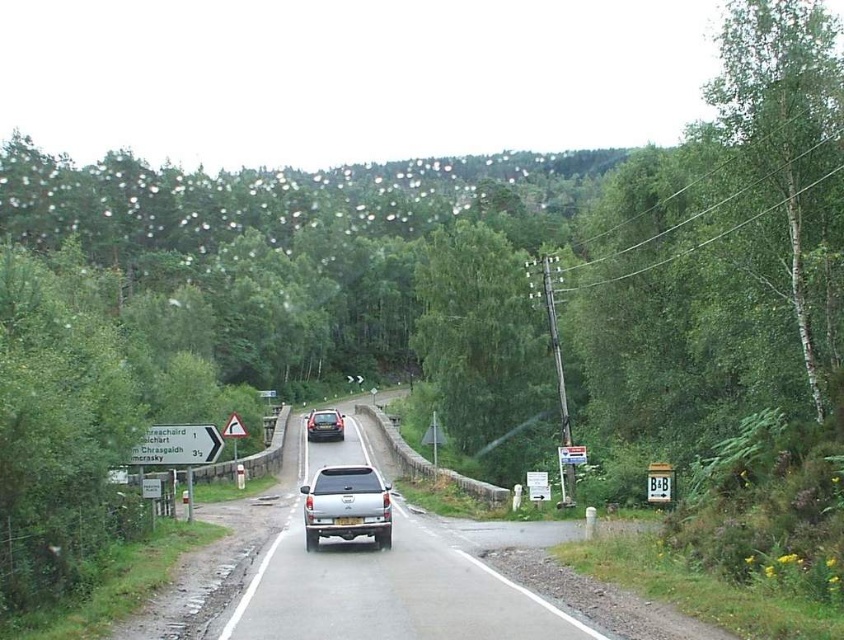
In the scene shown: You are a hiker trying to determine which object is taller between the white bark tree at right and the white plastic sign at left. Based on the scene, which one is taller?

Answer: The white bark tree at right is taller than the white plastic sign at left.

You are driving a car with a length of 5 meters. You need to pass between the white plastic sign at left and the black plastic triangle at upper center. Can your car fit through the space between them?

The white plastic sign at left and the black plastic triangle at upper center are 13.03 meters apart. Since the car is only 5 meters long, it can easily fit through the space between them.

From the picture: You are driving along the rural road and see the white plastic sign at left and the black plastic triangle at upper center. Which object is nearer to you as you drive forward?

The white plastic sign at left is closer to the viewer than the black plastic triangle at upper center, so the white plastic sign at left is nearer to you as you drive forward.